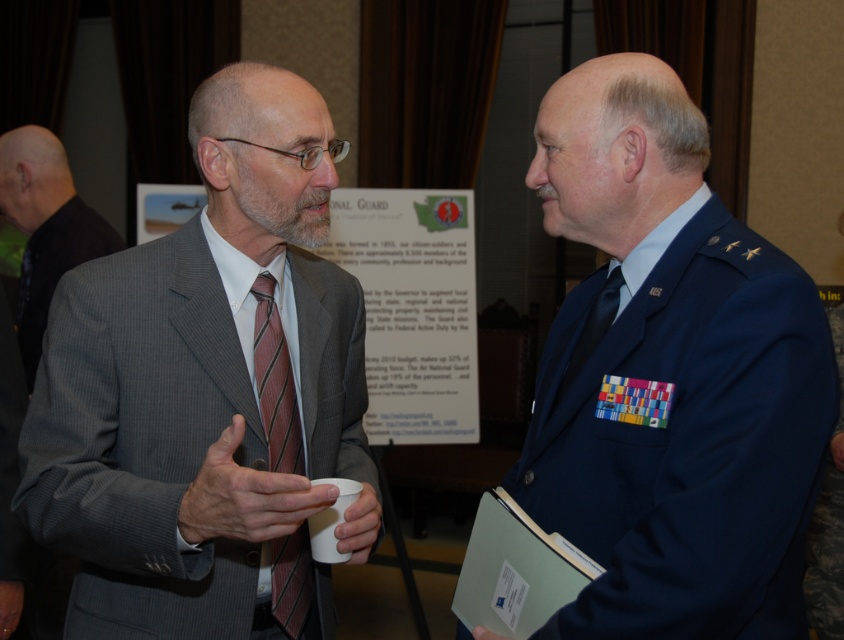
Does gray textured suit at left have a larger size compared to striped silk tie at center?

Indeed, gray textured suit at left has a larger size compared to striped silk tie at center.

Where is `gray textured suit at left`? The image size is (844, 640). gray textured suit at left is located at coordinates (46, 227).

Who is higher up, gray textured suit at left or black silk tie at center?

gray textured suit at left is above.

Does gray textured suit at left appear on the right side of black silk tie at center?

No, gray textured suit at left is not to the right of black silk tie at center.

The image size is (844, 640). Identify the location of gray textured suit at left. pos(46,227).

You are a GUI agent. You are given a task and a screenshot of the screen. Output one action in this format:
    pyautogui.click(x=<x>, y=<y>)
    Task: Click on the gray textured suit at left
    
    Given the screenshot: What is the action you would take?
    click(x=46, y=227)

Which is behind, point (706, 240) or point (599, 339)?

Point (599, 339)

Does blue uniform at center appear over black silk tie at center?

Incorrect, blue uniform at center is not positioned above black silk tie at center.

Does point (756, 522) lie behind point (618, 282)?

No.

This screenshot has width=844, height=640. I want to click on blue uniform at center, so click(x=669, y=376).